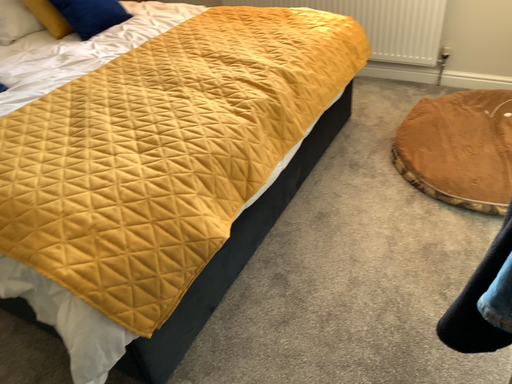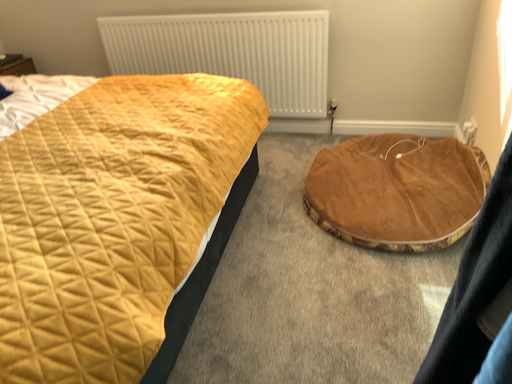
Question: How did the camera likely rotate when shooting the video?

Choices:
 (A) rotated downward
 (B) rotated upward

Answer: (B)